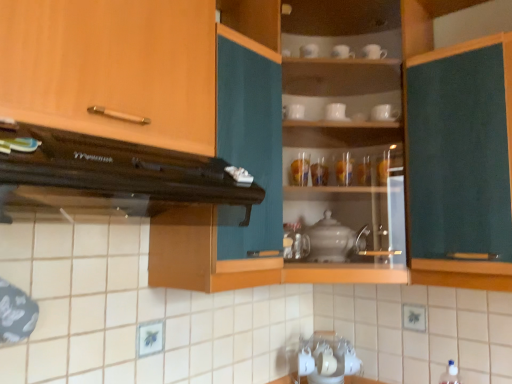
Question: Is wooden cabinet handle at upper left, arranged as the first cabinetry when viewed from the left, thinner than satin silver teapot at center?

Choices:
 (A) no
 (B) yes

Answer: (A)

Question: Can you confirm if wooden cabinet handle at upper left, which is the 2th cabinetry from right to left, is smaller than satin silver teapot at center?

Choices:
 (A) yes
 (B) no

Answer: (B)

Question: Does wooden cabinet handle at upper left, arranged as the first cabinetry when viewed from the left, have a lesser height compared to satin silver teapot at center?

Choices:
 (A) no
 (B) yes

Answer: (A)

Question: Does wooden cabinet handle at upper left, which is the 2th cabinetry from right to left, lie behind satin silver teapot at center?

Choices:
 (A) yes
 (B) no

Answer: (B)

Question: From a real-world perspective, is wooden cabinet handle at upper left, arranged as the first cabinetry when viewed from the left, physically below satin silver teapot at center?

Choices:
 (A) yes
 (B) no

Answer: (B)

Question: Is translucent glass vase at upper center, the 5th tableware viewed from the left, in front of or behind dark brown wood range hood at upper left in the image?

Choices:
 (A) front
 (B) behind

Answer: (B)

Question: From their relative heights in the image, would you say translucent glass vase at upper center, which is the second tableware from right to left, is taller or shorter than dark brown wood range hood at upper left?

Choices:
 (A) short
 (B) tall

Answer: (A)

Question: Is point (351, 175) closer or farther from the camera than point (139, 147)?

Choices:
 (A) closer
 (B) farther

Answer: (B)

Question: Is translucent glass vase at upper center, which is the second tableware from right to left, spatially inside dark brown wood range hood at upper left, or outside of it?

Choices:
 (A) inside
 (B) outside

Answer: (B)

Question: From their relative heights in the image, would you say white glossy cup at upper center, the third tableware viewed from the right, is taller or shorter than translucent glass vase at center, positioned as the fifth tableware in right-to-left order?

Choices:
 (A) tall
 (B) short

Answer: (B)

Question: In the image, is white glossy cup at upper center, which is counted as the fourth tableware, starting from the left, on the left side or the right side of translucent glass vase at center, positioned as the fifth tableware in right-to-left order?

Choices:
 (A) right
 (B) left

Answer: (A)

Question: Looking at the image, does white glossy cup at upper center, which is counted as the fourth tableware, starting from the left, seem bigger or smaller compared to translucent glass vase at center, positioned as the fifth tableware in right-to-left order?

Choices:
 (A) small
 (B) big

Answer: (A)

Question: Is white glossy cup at upper center, the third tableware viewed from the right, situated inside translucent glass vase at center, the 2th tableware positioned from the left, or outside?

Choices:
 (A) inside
 (B) outside

Answer: (B)

Question: Is white glossy cup at upper center, which is the sixth tableware from right to left, inside or outside of white ceramic cup at upper center, marked as the 1th tableware in a right-to-left arrangement?

Choices:
 (A) outside
 (B) inside

Answer: (A)

Question: Looking at the image, does white glossy cup at upper center, which is the sixth tableware from right to left, seem bigger or smaller compared to white ceramic cup at upper center, the sixth tableware positioned from the left?

Choices:
 (A) small
 (B) big

Answer: (A)